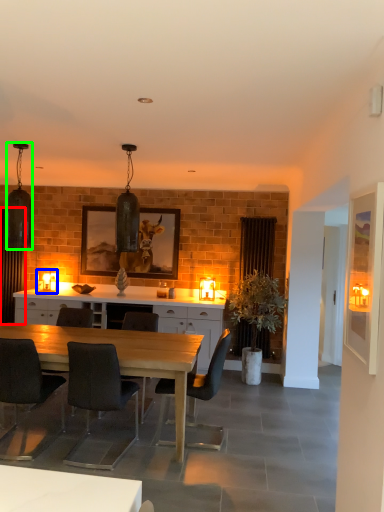
Question: Considering the real-world distances, which object is farthest from curtain (highlighted by a red box)? lamp (highlighted by a blue box) or lamp (highlighted by a green box)?

Choices:
 (A) lamp
 (B) lamp

Answer: (B)